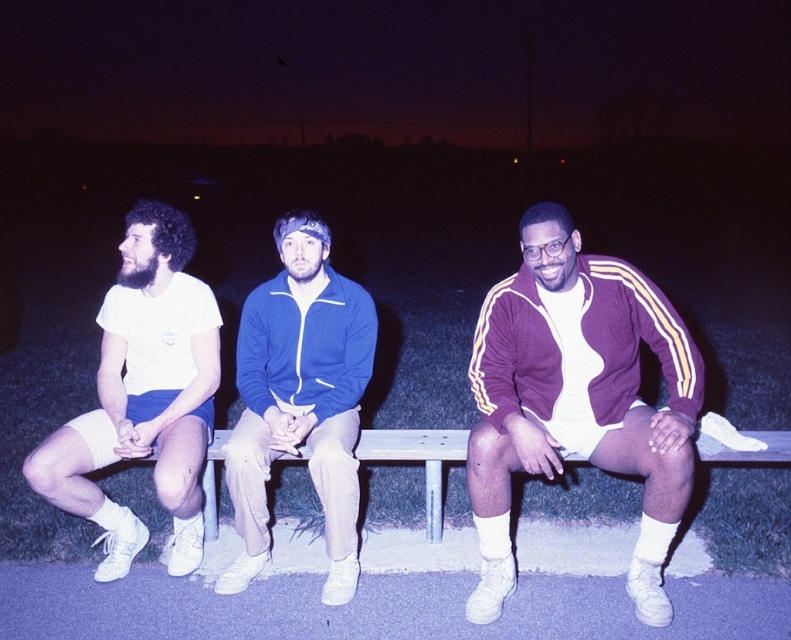
Question: Does purple velour tracksuit at center have a greater width compared to blue fleece jacket at center?

Choices:
 (A) no
 (B) yes

Answer: (B)

Question: Which of these objects is positioned closest to the white matte shorts at left?

Choices:
 (A) blue fleece jacket at center
 (B) purple velour tracksuit at center

Answer: (A)

Question: Is purple velour tracksuit at center to the left of blue fleece jacket at center from the viewer's perspective?

Choices:
 (A) no
 (B) yes

Answer: (A)

Question: Which is farther from the blue fleece jacket at center?

Choices:
 (A) white matte shorts at left
 (B) purple velour tracksuit at center

Answer: (B)

Question: Which object is the closest to the wooden bench at center?

Choices:
 (A) white matte shorts at left
 (B) purple velour tracksuit at center
 (C) blue fleece jacket at center

Answer: (C)

Question: Does purple velour tracksuit at center appear on the left side of white matte shorts at left?

Choices:
 (A) yes
 (B) no

Answer: (B)